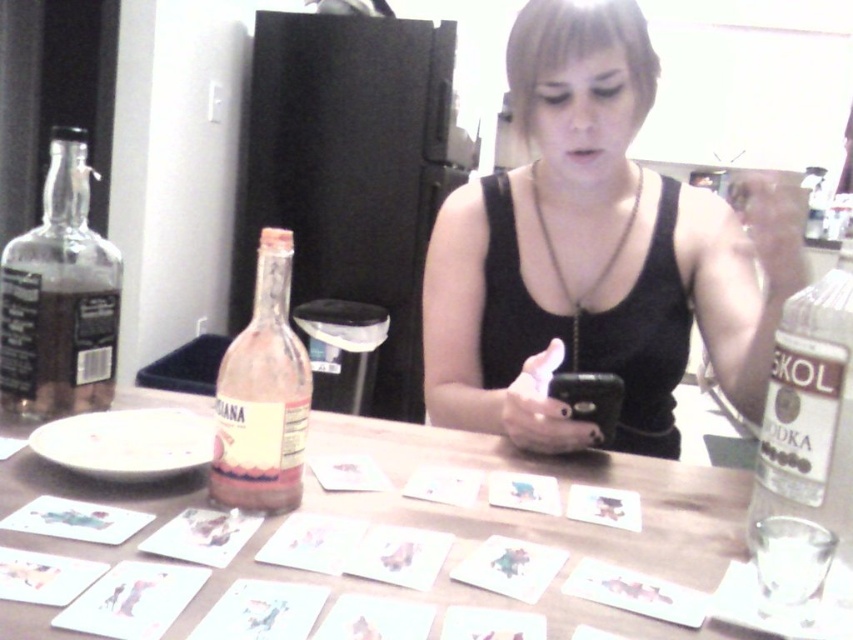
You are standing in the kitchen and see two points marked on the floor. The first point is at coordinate point [106,323] and the second is at point [229,456]. If you walk towards the second point, which direction should you move relative to the first point?

To reach the second point at [229,456] from the first point at [106,323], you should move forward since the second point is in front of the first point.